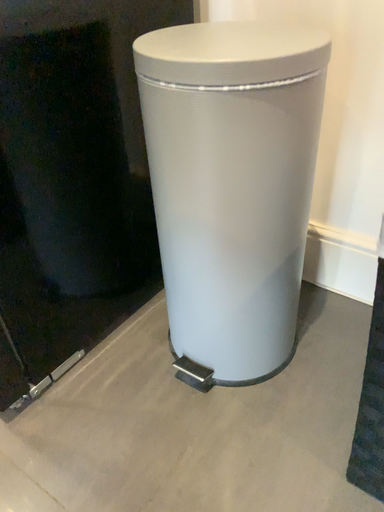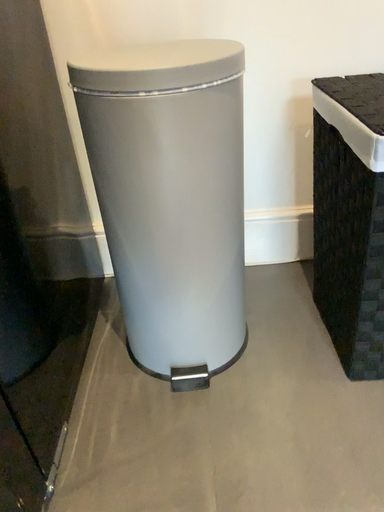
Question: How did the camera likely rotate when shooting the video?

Choices:
 (A) rotated upward
 (B) rotated downward

Answer: (A)